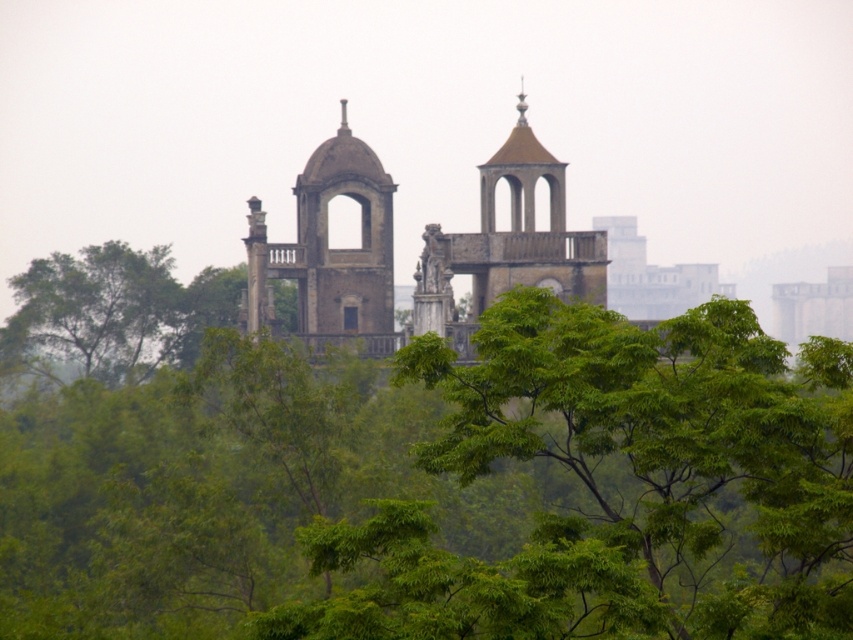
Question: Which point is closer to the camera taking this photo?

Choices:
 (A) (1, 360)
 (B) (297, 276)

Answer: (B)

Question: Does stone archway at center have a greater width compared to brown stone tower at center?

Choices:
 (A) no
 (B) yes

Answer: (A)

Question: Estimate the real-world distances between objects in this image. Which object is closer to the brown stone tower at center?

Choices:
 (A) green leafy tree at upper left
 (B) stone church at center
 (C) green leafy tree at center

Answer: (B)

Question: Does green leafy tree at upper left have a greater width compared to stone archway at center?

Choices:
 (A) yes
 (B) no

Answer: (A)

Question: Is green leafy tree at center closer to the viewer compared to green leafy tree at upper left?

Choices:
 (A) yes
 (B) no

Answer: (A)

Question: Which point is farther to the camera?

Choices:
 (A) green leafy tree at upper left
 (B) green leafy tree at center
 (C) brown stone tower at center
 (D) stone archway at center

Answer: (A)